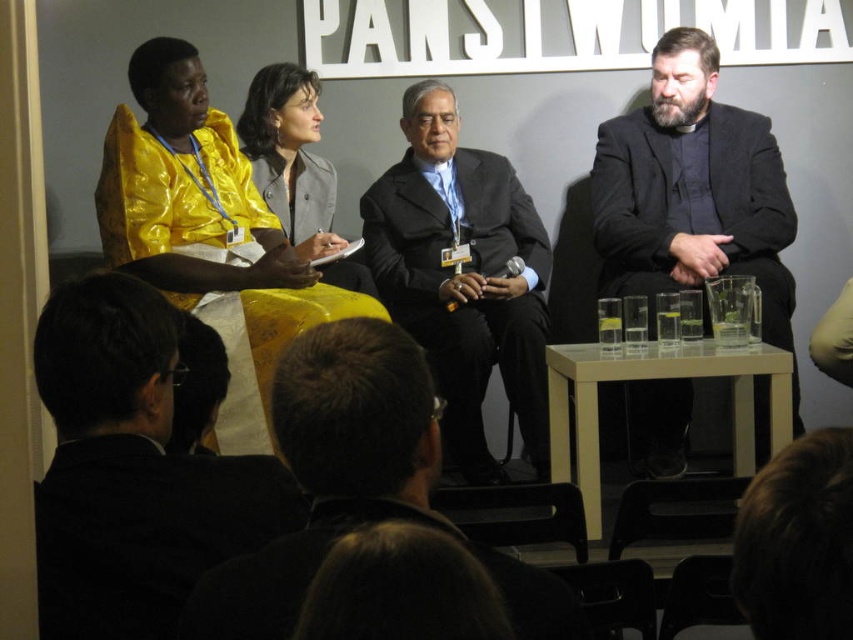
Question: Is black wool suit at right positioned before dark gray suit at center?

Choices:
 (A) yes
 (B) no

Answer: (A)

Question: Among these points, which one is nearest to the camera?

Choices:
 (A) (753, 115)
 (B) (258, 602)
 (C) (428, 113)
 (D) (149, 300)

Answer: (B)

Question: Which of the following is the closest to the observer?

Choices:
 (A) (144, 396)
 (B) (248, 588)
 (C) (693, 68)

Answer: (B)

Question: Which object appears farthest from the camera in this image?

Choices:
 (A) black suit at left
 (B) black matte suit at lower center
 (C) dark gray suit at center
 (D) black wool suit at right

Answer: (C)

Question: Is black suit at left to the right of dark brown hair at center from the viewer's perspective?

Choices:
 (A) yes
 (B) no

Answer: (B)

Question: Can you confirm if dark brown hair at center is positioned to the left of black smooth suit at center?

Choices:
 (A) no
 (B) yes

Answer: (A)